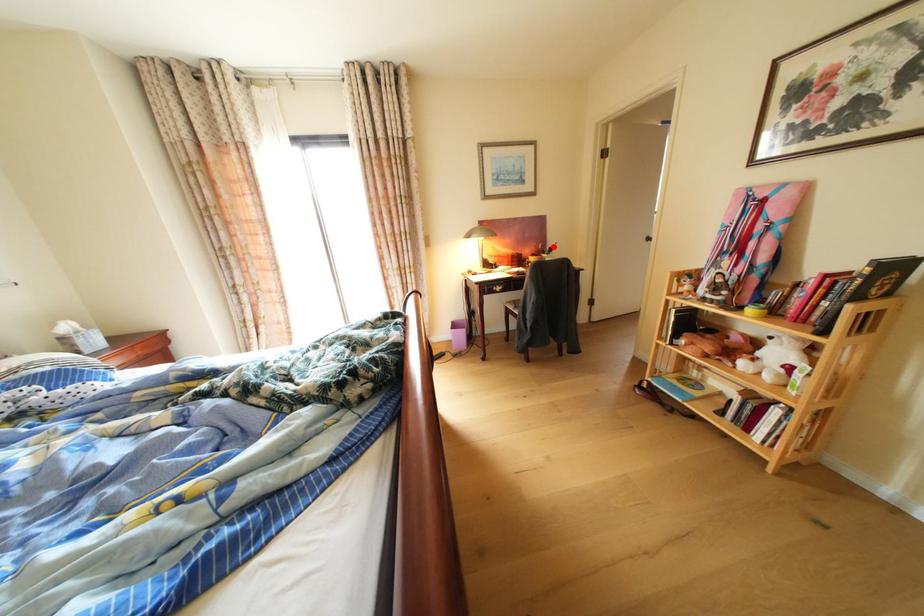
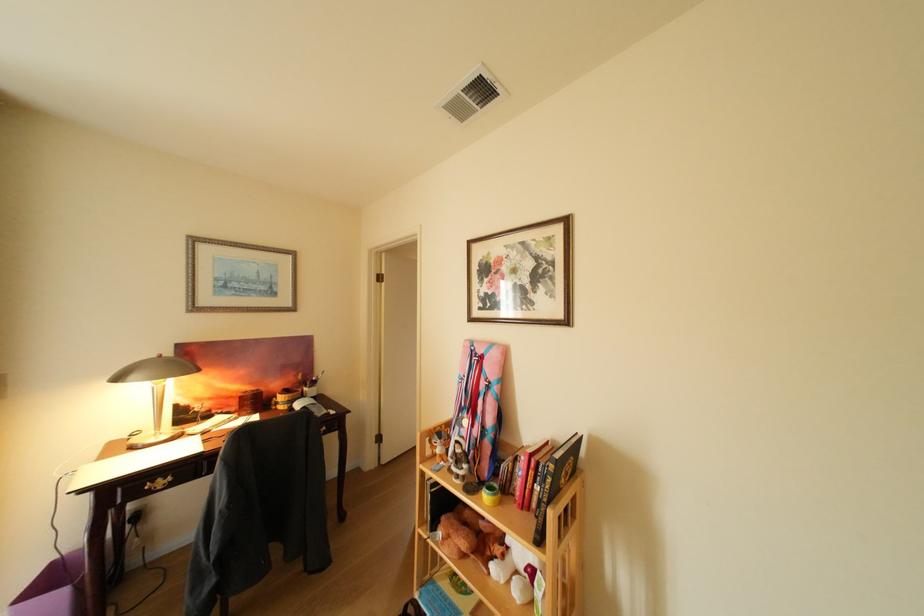
Question: A red point is marked in image1. In image2, is the corresponding 3D point closer to the camera or farther? Reply with the corresponding letter.

Choices:
 (A) The corresponding 3D point is closer.
 (B) The corresponding 3D point is farther.

Answer: (B)